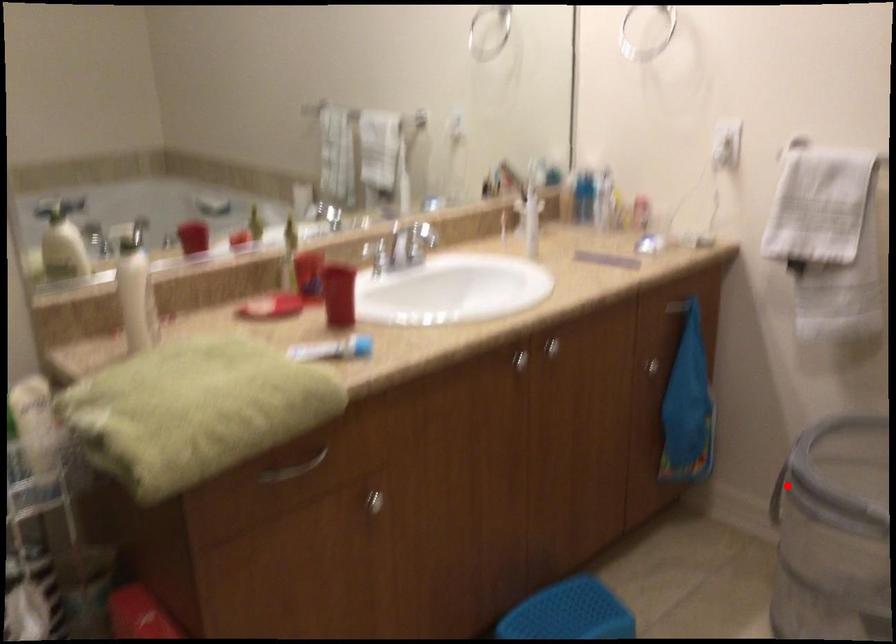
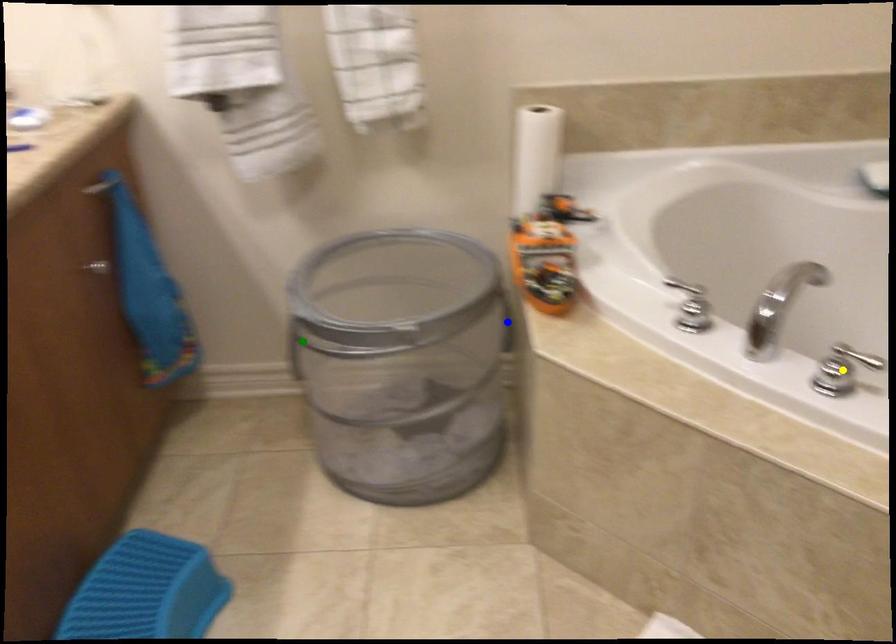
Question: I am providing you with two images of the same scene from different viewpoints. A red point is marked on the first image. You are given multiple points on the second image. Which spot in image 2 lines up with the point in image 1?

Choices:
 (A) yellow point
 (B) blue point
 (C) green point

Answer: (C)